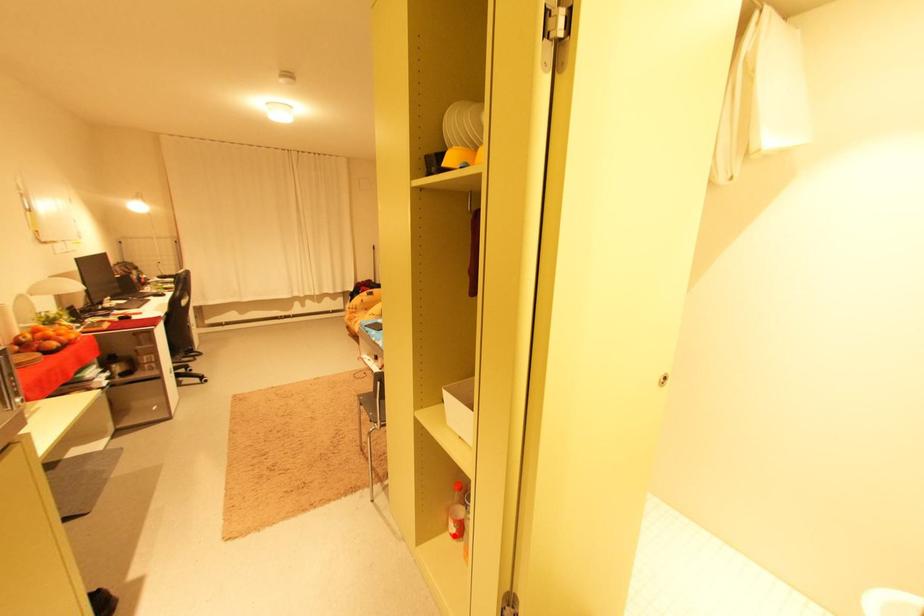
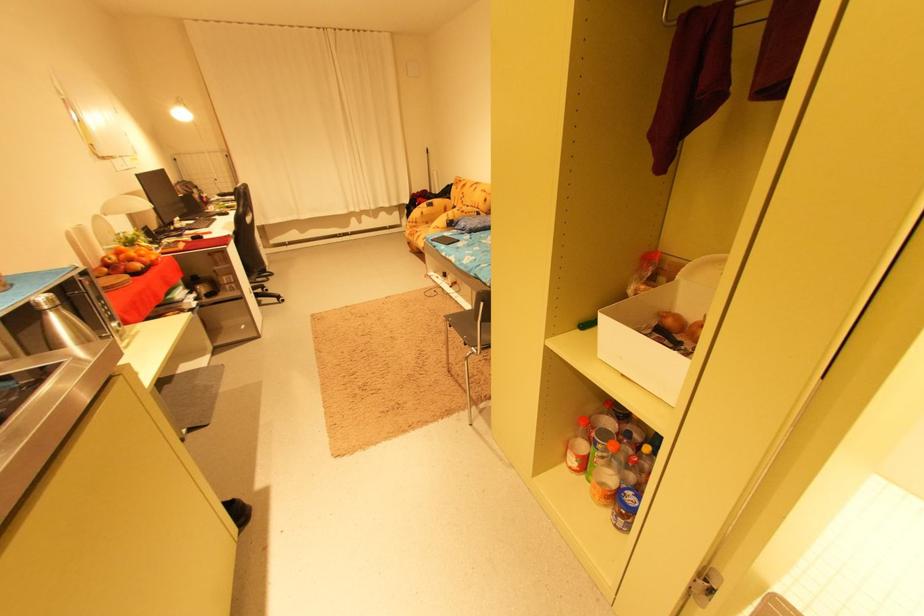
Locate, in the second image, the point that corresponds to the highlighted location in the first image.

(572, 467)